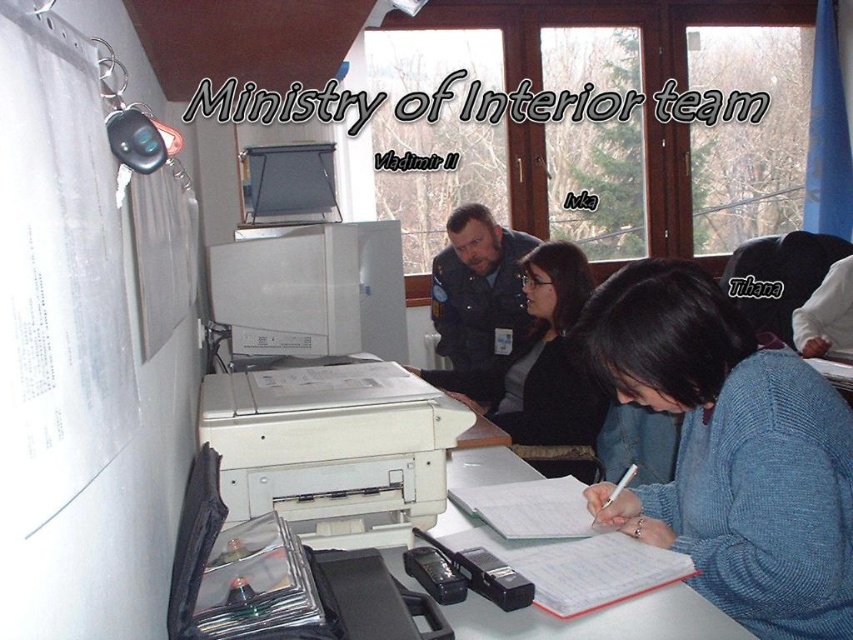
You are an employee in the Ministry of Interior office. You need to locate the blue knitted sweater at lower right and the black plastic text at upper center. Which object is positioned lower in the image?

The blue knitted sweater at lower right is positioned lower than the black plastic text at upper center.

In the Ministry of Interior office scene, there is a blue knitted sweater at lower right. Where exactly is the blue knitted sweater located in terms of coordinates?

The blue knitted sweater at lower right is located at coordinates point (729, 451).

You are an office worker who needs to place a new document organizer on your desk. The organizer requires 20 cm of space. You currently have the blue knitted sweater at lower right and the white plastic printer at center on your desk. Which item should you move to make space for the organizer?

The blue knitted sweater at lower right is larger in size than the white plastic printer at center, so moving the blue knitted sweater at lower right would free up more space for the organizer.